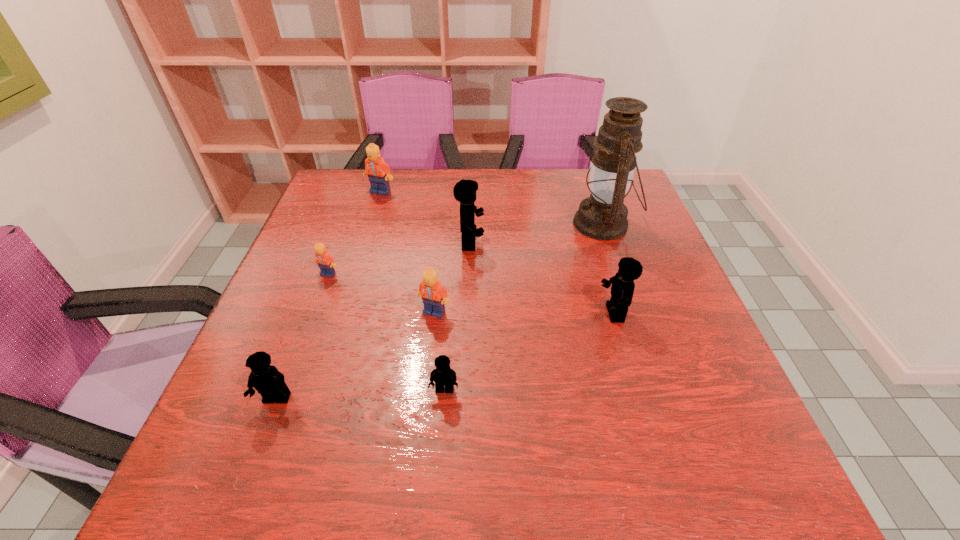
Where is `oil lamp`? oil lamp is located at coordinates (603, 216).

Where is `the tallest Lego`? The height and width of the screenshot is (540, 960). the tallest Lego is located at coordinates (464, 191).

You are a GUI agent. You are given a task and a screenshot of the screen. Output one action in this format:
    pyautogui.click(x=<x>, y=<y>)
    Task: Click on the second tallest object
    
    Given the screenshot: What is the action you would take?
    pyautogui.click(x=464, y=191)

Find the location of a particular element. The width and height of the screenshot is (960, 540). the farthest object is located at coordinates (378, 171).

At what (x,y) coordinates should I click in order to perform the action: click on the farthest Lego. Please return your answer as a coordinate pair (x, y). Image resolution: width=960 pixels, height=540 pixels. Looking at the image, I should click on (378, 171).

Where is `the rightmost Lego`? the rightmost Lego is located at coordinates (622, 288).

Image resolution: width=960 pixels, height=540 pixels. In order to click on the third nearest yellow Lego in this screenshot , I will do `click(622, 288)`.

This screenshot has width=960, height=540. I want to click on the rightmost orange Lego, so click(x=434, y=295).

Find the location of `the nearest orange Lego`. the nearest orange Lego is located at coordinates (434, 295).

The height and width of the screenshot is (540, 960). What are the coordinates of `the second smallest yellow Lego` in the screenshot? It's located at (267, 380).